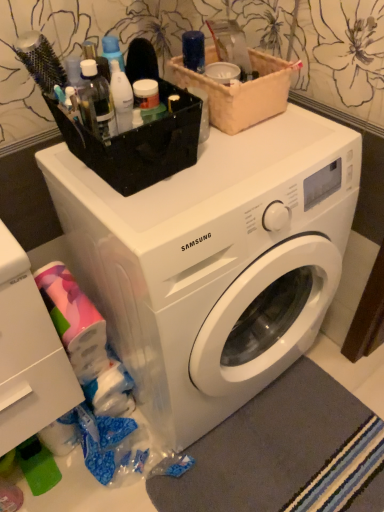
What do you see at coordinates (30, 365) in the screenshot?
I see `white plastic drawer at lower left` at bounding box center [30, 365].

The height and width of the screenshot is (512, 384). What do you see at coordinates (267, 447) in the screenshot? I see `gray soft rug at lower right` at bounding box center [267, 447].

The width and height of the screenshot is (384, 512). Describe the element at coordinates (215, 262) in the screenshot. I see `white plastic washing machine at center` at that location.

Locate an element on the screen. The height and width of the screenshot is (512, 384). beige fabric basket at upper center is located at coordinates (241, 92).

Considering the points (98, 210) and (69, 374), which point is behind, point (98, 210) or point (69, 374)?

Point (69, 374)

Is white plastic washing machine at center looking in the opposite direction of white plastic drawer at lower left?

No, white plastic washing machine at center is not facing away from white plastic drawer at lower left.

Considering the sizes of white plastic washing machine at center and white plastic drawer at lower left in the image, is white plastic washing machine at center wider or thinner than white plastic drawer at lower left?

Considering their sizes, white plastic washing machine at center looks broader than white plastic drawer at lower left.

From the image's perspective, between white plastic washing machine at center and white plastic drawer at lower left, which one is located above?

From the image's view, white plastic washing machine at center is above.

Considering the sizes of objects gray soft rug at lower right and white plastic washing machine at center in the image provided, who is wider, gray soft rug at lower right or white plastic washing machine at center?

white plastic washing machine at center is wider.

The image size is (384, 512). Identify the location of washing machine to the left of gray soft rug at lower right. tap(215, 262).

Does gray soft rug at lower right have a smaller size compared to white plastic washing machine at center?

Yes.

Is gray soft rug at lower right oriented away from white plastic washing machine at center?

gray soft rug at lower right does not have its back to white plastic washing machine at center.

Measure the distance between beige fabric basket at upper center and white plastic drawer at lower left.

beige fabric basket at upper center and white plastic drawer at lower left are 26.24 inches apart.

Is white plastic drawer at lower left at the back of beige fabric basket at upper center?

No, beige fabric basket at upper center's orientation is not away from white plastic drawer at lower left.

From a real-world perspective, which is physically above, beige fabric basket at upper center or white plastic drawer at lower left?

In real-world perspective, beige fabric basket at upper center is above.

This screenshot has width=384, height=512. What are the coordinates of `drawer that appears in front of the beige fabric basket at upper center` in the screenshot? It's located at click(x=30, y=365).

From a real-world perspective, is white plastic drawer at lower left positioned over beige fabric basket at upper center based on gravity?

No.

Could you tell me if white plastic drawer at lower left is facing beige fabric basket at upper center?

No.

Between white plastic drawer at lower left and beige fabric basket at upper center, which one appears on the left side from the viewer's perspective?

Answer: Positioned to the left is white plastic drawer at lower left.

What's the angular difference between white plastic drawer at lower left and beige fabric basket at upper center's facing directions?

1.2 degrees.

Considering the positions of point (277, 58) and point (314, 470), is point (277, 58) closer or farther from the camera than point (314, 470)?

Point (277, 58) is closer to the camera than point (314, 470).

Can you confirm if beige fabric basket at upper center is taller than gray soft rug at lower right?

Indeed, beige fabric basket at upper center has a greater height compared to gray soft rug at lower right.

Where is `bath mat that is below the beige fabric basket at upper center (from the image's perspective)`? This screenshot has width=384, height=512. bath mat that is below the beige fabric basket at upper center (from the image's perspective) is located at coordinates (267, 447).

Which is more to the left, beige fabric basket at upper center or gray soft rug at lower right?

beige fabric basket at upper center is more to the left.

Where is `washing machine on the left of the beige fabric basket at upper center`? This screenshot has height=512, width=384. washing machine on the left of the beige fabric basket at upper center is located at coordinates (215, 262).

Does white plastic washing machine at center have a larger size compared to beige fabric basket at upper center?

Yes, white plastic washing machine at center is bigger than beige fabric basket at upper center.

Are white plastic washing machine at center and beige fabric basket at upper center far apart?

Actually, white plastic washing machine at center and beige fabric basket at upper center are a little close together.

Considering the relative sizes of white plastic washing machine at center and beige fabric basket at upper center in the image provided, is white plastic washing machine at center taller than beige fabric basket at upper center?

Indeed, white plastic washing machine at center has a greater height compared to beige fabric basket at upper center.

Considering their positions, is gray soft rug at lower right located in front of or behind beige fabric basket at upper center?

Clearly, gray soft rug at lower right is behind beige fabric basket at upper center.

In the image, is gray soft rug at lower right on the left side or the right side of beige fabric basket at upper center?

In the image, gray soft rug at lower right appears on the right side of beige fabric basket at upper center.

Is gray soft rug at lower right with beige fabric basket at upper center?

No, gray soft rug at lower right is not beside beige fabric basket at upper center.

Considering the sizes of gray soft rug at lower right and beige fabric basket at upper center in the image, is gray soft rug at lower right bigger or smaller than beige fabric basket at upper center?

Considering their sizes, gray soft rug at lower right takes up less space than beige fabric basket at upper center.

The height and width of the screenshot is (512, 384). Identify the location of drawer on the left of white plastic washing machine at center. (30, 365).

Locate an element on the screen. washing machine above the gray soft rug at lower right (from a real-world perspective) is located at coordinates (215, 262).

Looking at the image, which one is located closer to gray soft rug at lower right, beige fabric basket at upper center or white plastic washing machine at center?

Based on the image, white plastic washing machine at center appears to be nearer to gray soft rug at lower right.

Based on their spatial positions, is beige fabric basket at upper center or gray soft rug at lower right closer to white plastic drawer at lower left?

gray soft rug at lower right lies closer to white plastic drawer at lower left than the other object.

In the scene shown: Looking at the image, which one is located further to gray soft rug at lower right, white plastic drawer at lower left or white plastic washing machine at center?

The object further to gray soft rug at lower right is white plastic drawer at lower left.

Which object lies further to the anchor point white plastic washing machine at center, beige fabric basket at upper center or white plastic drawer at lower left?

beige fabric basket at upper center.

From the image, which object appears to be farther from white plastic drawer at lower left, white plastic washing machine at center or gray soft rug at lower right?

gray soft rug at lower right is positioned further to the anchor white plastic drawer at lower left.

Based on their spatial positions, is white plastic drawer at lower left or white plastic washing machine at center closer to beige fabric basket at upper center?

Among the two, white plastic washing machine at center is located nearer to beige fabric basket at upper center.

Which object lies nearer to the anchor point gray soft rug at lower right, beige fabric basket at upper center or white plastic drawer at lower left?

white plastic drawer at lower left is positioned closer to the anchor gray soft rug at lower right.

Looking at this image, when comparing their distances from white plastic drawer at lower left, does white plastic washing machine at center or beige fabric basket at upper center seem closer?

white plastic washing machine at center is positioned closer to the anchor white plastic drawer at lower left.

Identify the location of washing machine between beige fabric basket at upper center and gray soft rug at lower right in the up-down direction. pos(215,262).

Where is `washing machine between white plastic drawer at lower left and beige fabric basket at upper center in the horizontal direction`? washing machine between white plastic drawer at lower left and beige fabric basket at upper center in the horizontal direction is located at coordinates (215, 262).

You are a GUI agent. You are given a task and a screenshot of the screen. Output one action in this format:
    pyautogui.click(x=<x>, y=<y>)
    Task: Click on the drawer between beige fabric basket at upper center and gray soft rug at lower right from top to bottom
    The width and height of the screenshot is (384, 512).
    Given the screenshot: What is the action you would take?
    pyautogui.click(x=30, y=365)

Locate an element on the screen. washing machine between white plastic drawer at lower left and gray soft rug at lower right is located at coordinates (215, 262).